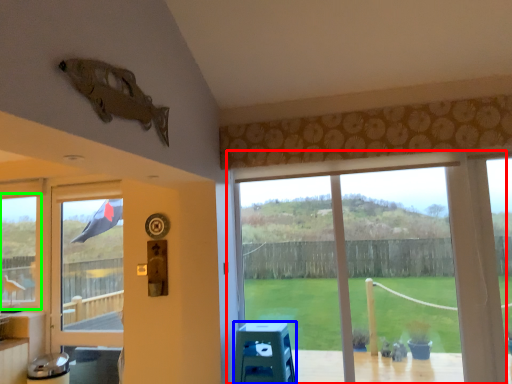
Question: Which is farther away from window (highlighted by a red box)? stool (highlighted by a blue box) or window (highlighted by a green box)?

Choices:
 (A) stool
 (B) window

Answer: (B)